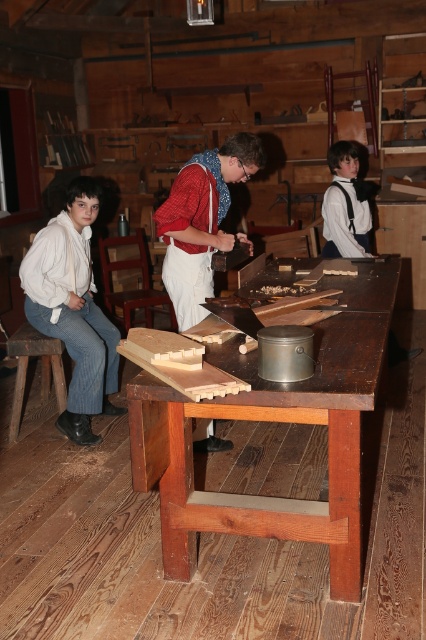
You are a visitor in this workshop and want to hang a picture on the wall. You have a hammer that you need to reach. Which object between the white cotton shirt at center and the wooden at left is closer to the hammer?

The white cotton shirt at center is much taller than the wooden at left, so the wooden at left is closer to the hammer.

You are standing in the historical carpentry workshop and need to place a new tool exactly at the point marked by coordinates point (273, 420). Where should you place it?

You should place the new tool at the point marked by coordinates point (273, 420) on the wooden table at center.